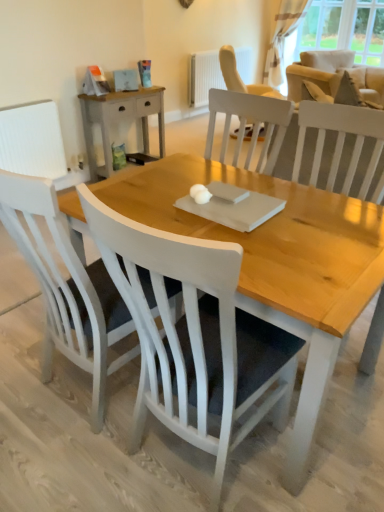
Question: From a real-world perspective, is light wood/rough surface nightstand at upper left below white wood chair at center, which is the second chair from left to right?

Choices:
 (A) yes
 (B) no

Answer: (A)

Question: From the image's perspective, would you say light wood/rough surface nightstand at upper left is positioned over white wood chair at center, the third chair positioned from the back?

Choices:
 (A) no
 (B) yes

Answer: (B)

Question: From a real-world perspective, does light wood/rough surface nightstand at upper left stand above white wood chair at center, which ranks as the first chair in front-to-back order?

Choices:
 (A) no
 (B) yes

Answer: (A)

Question: Does light wood/rough surface nightstand at upper left come in front of white wood chair at center, which ranks as the first chair in front-to-back order?

Choices:
 (A) yes
 (B) no

Answer: (B)

Question: Is light wood/rough surface nightstand at upper left not inside white wood chair at center, the second chair positioned from the right?

Choices:
 (A) yes
 (B) no

Answer: (A)

Question: Based on their positions, is transparent curtain at upper right located to the left or right of white wood chair at center, the second chair positioned from the right?

Choices:
 (A) left
 (B) right

Answer: (B)

Question: Is transparent curtain at upper right bigger or smaller than white wood chair at center, the second chair positioned from the right?

Choices:
 (A) big
 (B) small

Answer: (B)

Question: Considering the positions of transparent curtain at upper right and white wood chair at center, the third chair positioned from the back, in the image, is transparent curtain at upper right taller or shorter than white wood chair at center, the third chair positioned from the back,?

Choices:
 (A) tall
 (B) short

Answer: (B)

Question: Considering the positions of point (362, 59) and point (203, 285), is point (362, 59) closer or farther from the camera than point (203, 285)?

Choices:
 (A) closer
 (B) farther

Answer: (B)

Question: Do you think beige fabric armchair at upper right is within white textured radiator at upper center, or outside of it?

Choices:
 (A) outside
 (B) inside

Answer: (A)

Question: Is beige fabric armchair at upper right bigger or smaller than white textured radiator at upper center?

Choices:
 (A) small
 (B) big

Answer: (B)

Question: Is point (291, 96) closer or farther from the camera than point (216, 78)?

Choices:
 (A) farther
 (B) closer

Answer: (B)

Question: From the image's perspective, is beige fabric armchair at upper right positioned above or below white textured radiator at upper center?

Choices:
 (A) below
 (B) above

Answer: (A)

Question: Considering their positions, is light wood/rough surface nightstand at upper left located in front of or behind transparent curtain at upper right?

Choices:
 (A) behind
 (B) front

Answer: (B)

Question: Considering the positions of light wood/rough surface nightstand at upper left and transparent curtain at upper right in the image, is light wood/rough surface nightstand at upper left taller or shorter than transparent curtain at upper right?

Choices:
 (A) short
 (B) tall

Answer: (A)